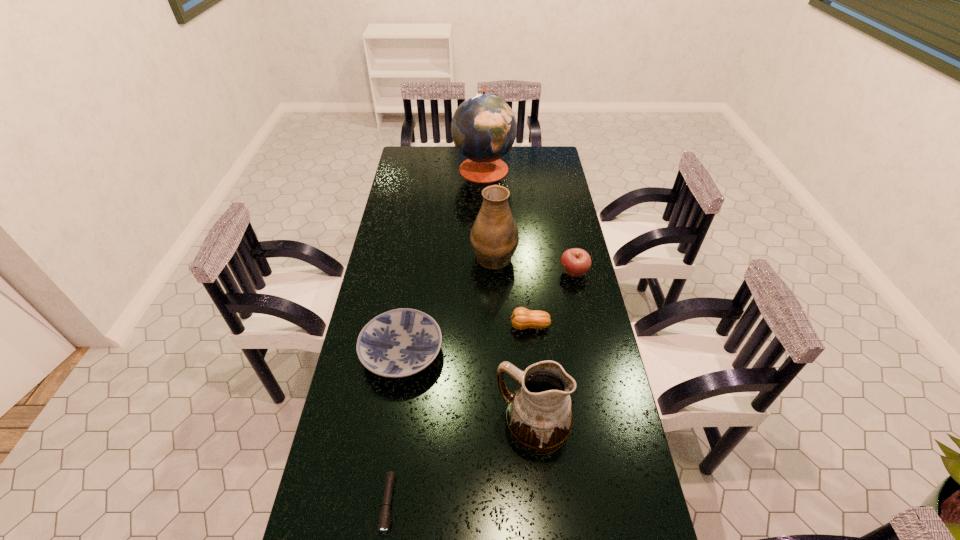
Identify the location of vacant space situated with the Americas facing the viewer on the farthest object. Image resolution: width=960 pixels, height=540 pixels. (x=422, y=168).

Locate an element on the screen. This screenshot has width=960, height=540. vacant area located with the Americas facing the viewer on the farthest object is located at coordinates (400, 168).

Find the location of a particular element. Image resolution: width=960 pixels, height=540 pixels. vacant space located 0.160m with the Americas facing the viewer on the farthest object is located at coordinates (420, 168).

In order to click on vacant space situated on the handle side of the farther pitcher in this screenshot , I will do `click(492, 208)`.

Locate an element on the screen. vacant region located on the handle side of the farther pitcher is located at coordinates (492, 226).

The height and width of the screenshot is (540, 960). What are the coordinates of `free space located on the handle side of the farther pitcher` in the screenshot? It's located at (492, 206).

Find the location of a particular element. The width and height of the screenshot is (960, 540). free space located 0.160m from the spout of the second nearest object is located at coordinates (439, 427).

I want to click on vacant region located from the spout of the second nearest object, so click(x=386, y=427).

Locate an element on the screen. The image size is (960, 540). free space located from the spout of the second nearest object is located at coordinates (357, 427).

The width and height of the screenshot is (960, 540). What are the coordinates of `free space located 0.200m on the side of the rightmost object with the unique marking` in the screenshot? It's located at (507, 273).